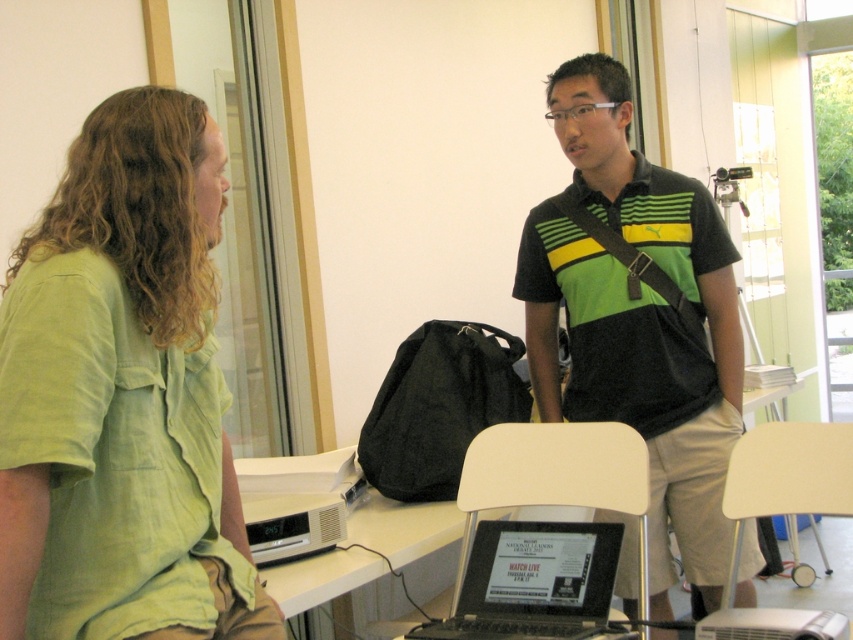
Question: Which point is farther to the camera?

Choices:
 (A) (212, 168)
 (B) (637, 230)
 (C) (555, 570)

Answer: (B)

Question: Which of the following is the closest to the observer?

Choices:
 (A) (602, 205)
 (B) (38, 570)

Answer: (B)

Question: Which of these objects is positioned farthest from the green striped polo shirt at center?

Choices:
 (A) black glossy laptop at lower center
 (B) green cotton shirt at left

Answer: (B)

Question: Observing the image, what is the correct spatial positioning of green cotton shirt at left in reference to black glossy laptop at lower center?

Choices:
 (A) below
 (B) above

Answer: (B)

Question: Is green striped polo shirt at center to the right of black glossy laptop at lower center from the viewer's perspective?

Choices:
 (A) yes
 (B) no

Answer: (A)

Question: Is green striped polo shirt at center below black glossy laptop at lower center?

Choices:
 (A) yes
 (B) no

Answer: (B)